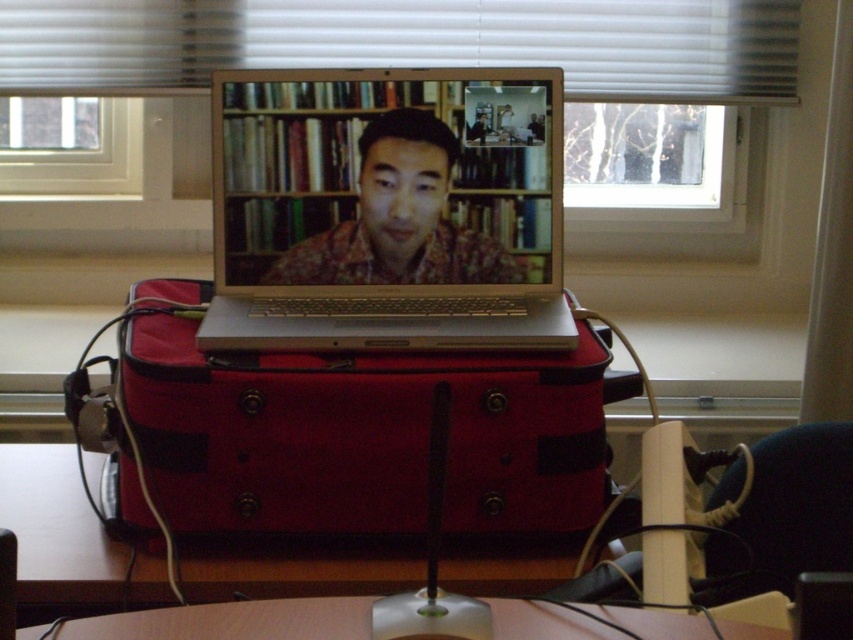
Is point (169, 358) positioned in front of point (666, 10)?

That is True.

Which is in front, point (305, 419) or point (194, 33)?

Positioned in front is point (305, 419).

Locate an element on the screen. The height and width of the screenshot is (640, 853). red fabric suitcase at center is located at coordinates (363, 436).

Consider the image. Is matte brown shirt at center thinner than wooden table at center?

Correct, matte brown shirt at center's width is less than wooden table at center's.

Can you confirm if matte brown shirt at center is shorter than wooden table at center?

In fact, matte brown shirt at center may be taller than wooden table at center.

The image size is (853, 640). What do you see at coordinates (399, 218) in the screenshot? I see `matte brown shirt at center` at bounding box center [399, 218].

Locate an element on the screen. matte brown shirt at center is located at coordinates (399, 218).

Does wooden at center have a larger size compared to wooden table at center?

Yes.

Which is in front, point (373, 579) or point (289, 637)?

Point (289, 637) is in front.

Is point (80, 496) more distant than point (653, 637)?

Yes, point (80, 496) is behind point (653, 637).

I want to click on wooden at center, so click(56, 529).